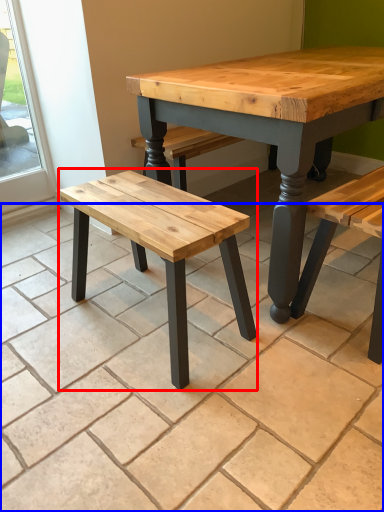
Question: Which object appears closest to the camera in this image, stool (highlighted by a red box) or tile (highlighted by a blue box)?

Choices:
 (A) stool
 (B) tile

Answer: (B)